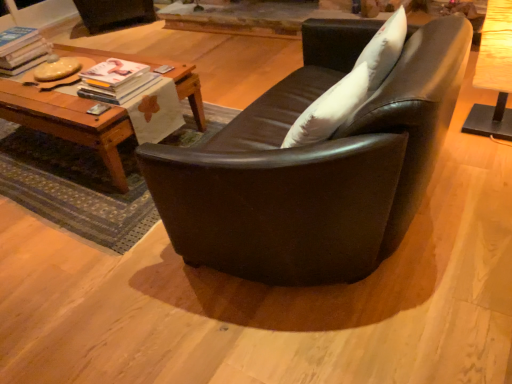
At what (x,y) coordinates should I click in order to perform the action: click on vacant region below wooden table at right, acting as the 1th table starting from the right (from a real-world perspective). Please return your answer as a coordinate pair (x, y). Looking at the image, I should click on (489, 132).